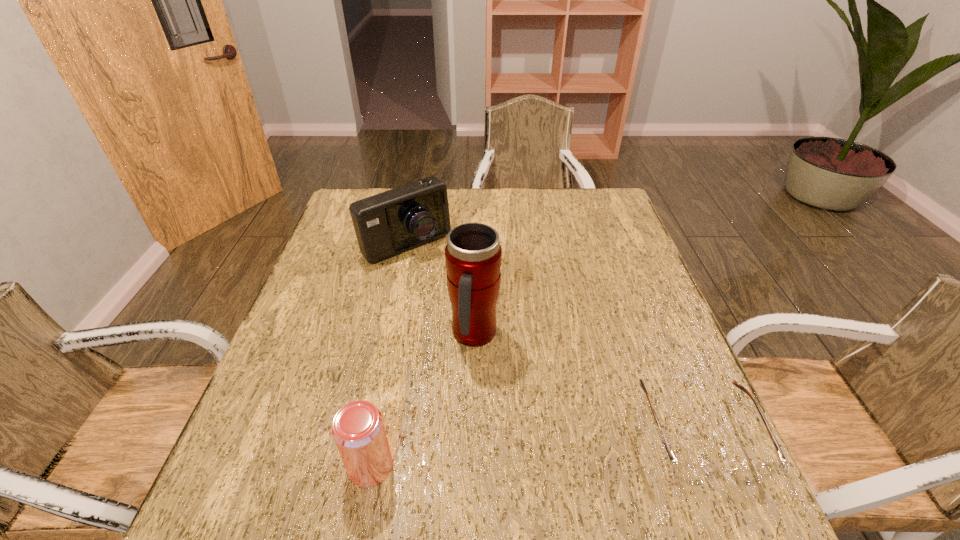
Image resolution: width=960 pixels, height=540 pixels. Identify the location of beer can. (358, 430).

Where is `the shortest object`? the shortest object is located at coordinates (691, 473).

This screenshot has width=960, height=540. In order to click on the rightmost object in this screenshot , I will do `click(691, 473)`.

Find the location of a particular element. the farthest object is located at coordinates (386, 224).

Identify the location of the second tallest object. (386, 224).

Where is `thermos bottle`? thermos bottle is located at coordinates (473, 256).

Identify the location of the third nearest object. (473, 256).

This screenshot has width=960, height=540. Identify the location of free spot located 0.330m on the back of the second shortest object. (398, 319).

The image size is (960, 540). Identify the location of free space located 0.340m on the front-facing side of the second tallest object. (494, 340).

The height and width of the screenshot is (540, 960). I want to click on vacant space located on the front-facing side of the second tallest object, so click(499, 346).